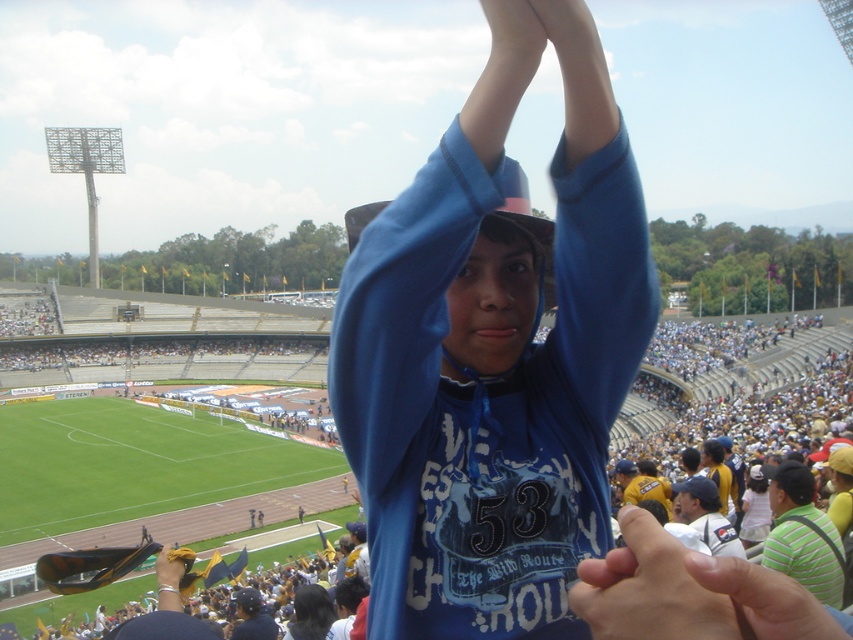
Question: Is yellow shirt at center below smooth yellow glove at center?

Choices:
 (A) no
 (B) yes

Answer: (A)

Question: Which point is farther to the camera?

Choices:
 (A) (169, 582)
 (B) (636, 548)

Answer: (A)

Question: Can you confirm if green striped shirt at center is positioned above smooth yellow glove at center?

Choices:
 (A) no
 (B) yes

Answer: (B)

Question: Which object is positioned closest to the green striped shirt at center?

Choices:
 (A) yellow shirt at center
 (B) smooth skin hand at center
 (C) white jersey at center

Answer: (C)

Question: Does white jersey at center appear on the left side of smooth yellow glove at center?

Choices:
 (A) yes
 (B) no

Answer: (B)

Question: Which point is farther to the camera?

Choices:
 (A) (444, 483)
 (B) (630, 563)
 (C) (804, 586)

Answer: (C)